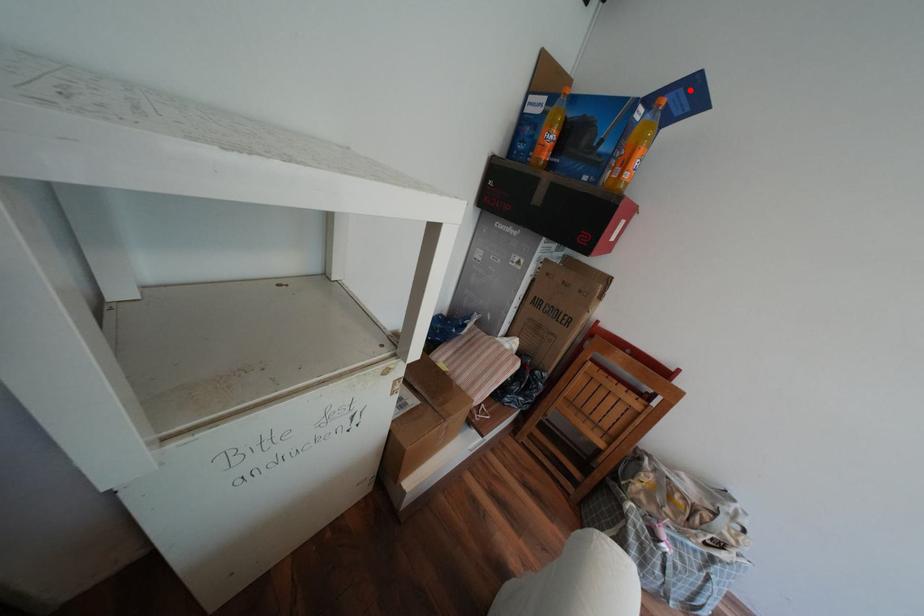
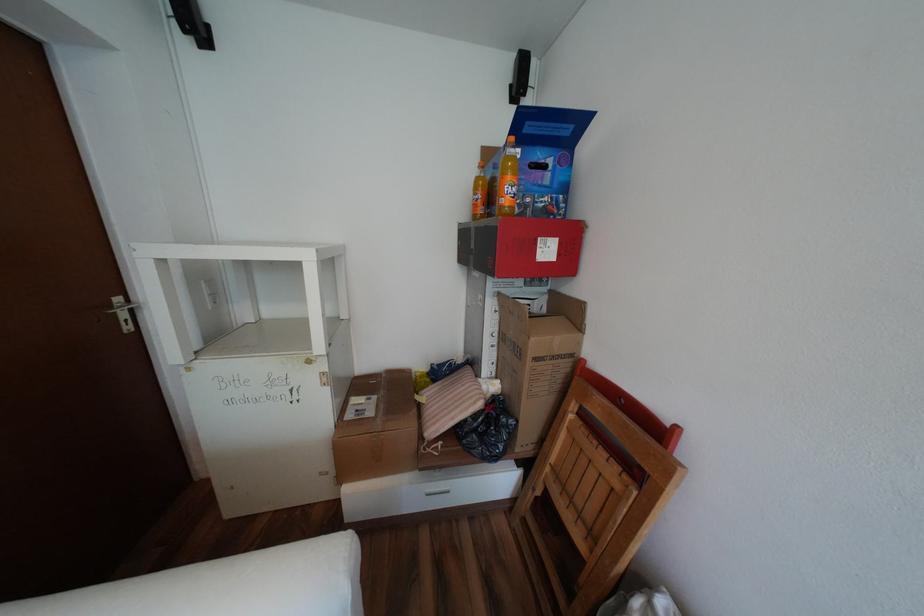
Where in the second image is the point corresponding to the highlighted location from the first image?

(537, 123)